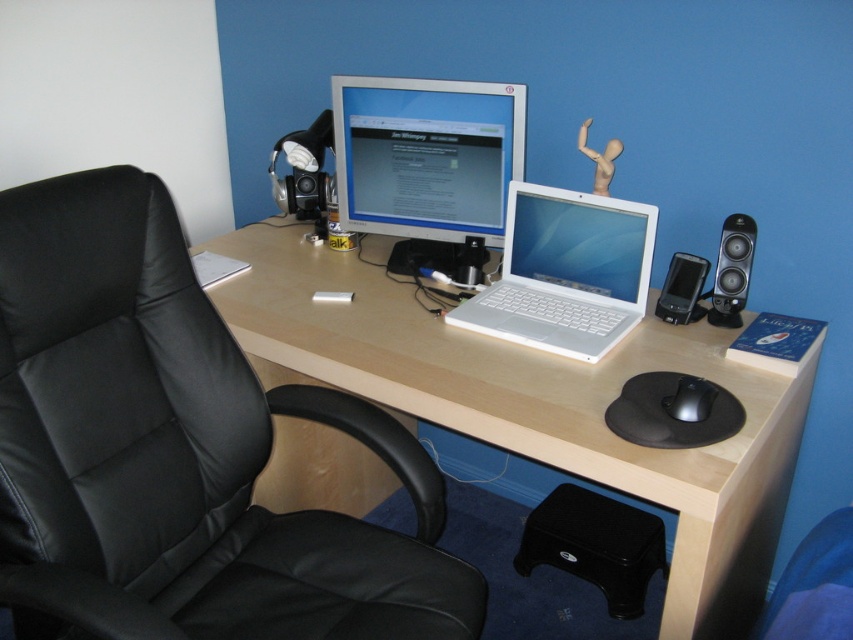
Question: Does white glossy laptop at center have a lesser width compared to black plastic speaker at right?

Choices:
 (A) yes
 (B) no

Answer: (B)

Question: Does light wood/woodendesk at center have a larger size compared to black matte mouse at lower right?

Choices:
 (A) no
 (B) yes

Answer: (B)

Question: Among these points, which one is nearest to the camera?

Choices:
 (A) (740, 236)
 (B) (665, 400)
 (C) (115, 451)
 (D) (392, 92)

Answer: (C)

Question: Which of the following is the farthest from the observer?

Choices:
 (A) (724, 236)
 (B) (682, 396)

Answer: (A)

Question: Estimate the real-world distances between objects in this image. Which object is closer to the white glossy laptop at center?

Choices:
 (A) black matte mouse at lower right
 (B) black leather swivel chair at left
 (C) matte silver monitor at center
 (D) light wood/woodendesk at center

Answer: (C)

Question: Is black leather swivel chair at left wider than black matte mouse at lower right?

Choices:
 (A) no
 (B) yes

Answer: (B)